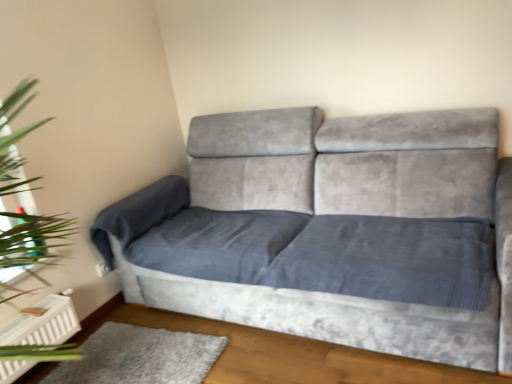
Question: Is green leafy plant at left at the left side of gray plush rug at lower left?

Choices:
 (A) no
 (B) yes

Answer: (B)

Question: Does green leafy plant at left have a lesser height compared to gray plush rug at lower left?

Choices:
 (A) yes
 (B) no

Answer: (B)

Question: Could you tell me if green leafy plant at left is facing gray plush rug at lower left?

Choices:
 (A) no
 (B) yes

Answer: (A)

Question: From the image's perspective, would you say green leafy plant at left is shown under gray plush rug at lower left?

Choices:
 (A) yes
 (B) no

Answer: (B)

Question: Can you confirm if green leafy plant at left is wider than gray plush rug at lower left?

Choices:
 (A) yes
 (B) no

Answer: (B)

Question: Looking at their shapes, would you say green leafy plant at left is wider or thinner than gray plush rug at lower left?

Choices:
 (A) thin
 (B) wide

Answer: (A)

Question: Considering their positions, is green leafy plant at left located in front of or behind gray plush rug at lower left?

Choices:
 (A) front
 (B) behind

Answer: (A)

Question: From a real-world perspective, relative to gray plush rug at lower left, is green leafy plant at left vertically above or below?

Choices:
 (A) above
 (B) below

Answer: (A)

Question: From the image's perspective, relative to gray plush rug at lower left, is green leafy plant at left above or below?

Choices:
 (A) above
 (B) below

Answer: (A)

Question: Is point (41, 238) positioned closer to the camera than point (462, 261)?

Choices:
 (A) closer
 (B) farther

Answer: (A)

Question: Is teal glass at left bigger or smaller than velvet grey couch at center?

Choices:
 (A) big
 (B) small

Answer: (B)

Question: In terms of width, does teal glass at left look wider or thinner when compared to velvet grey couch at center?

Choices:
 (A) wide
 (B) thin

Answer: (B)

Question: From a real-world perspective, is teal glass at left physically located above or below velvet grey couch at center?

Choices:
 (A) below
 (B) above

Answer: (B)

Question: From a real-world perspective, is green leafy plant at left physically located above or below velvet grey couch at center?

Choices:
 (A) above
 (B) below

Answer: (A)

Question: Is green leafy plant at left bigger or smaller than velvet grey couch at center?

Choices:
 (A) small
 (B) big

Answer: (A)